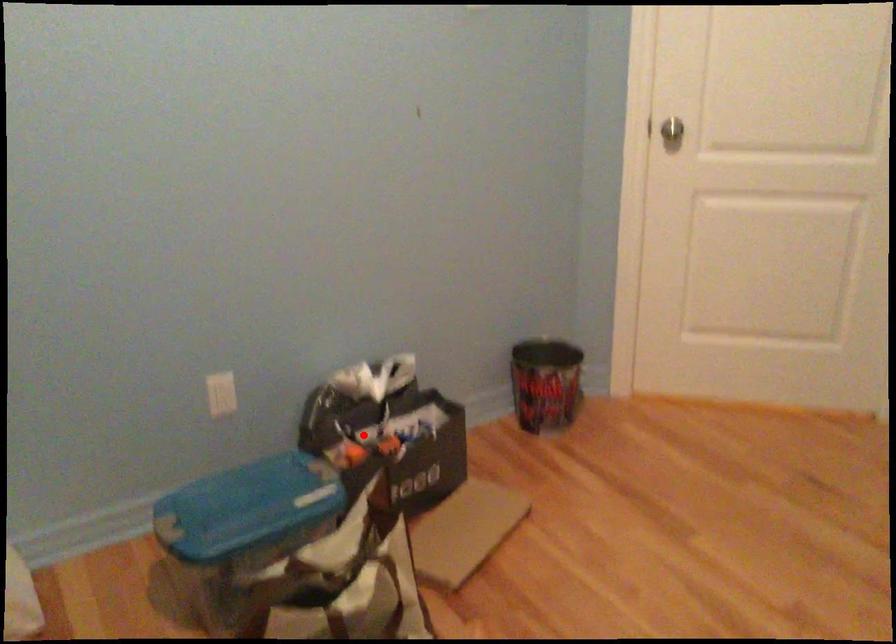
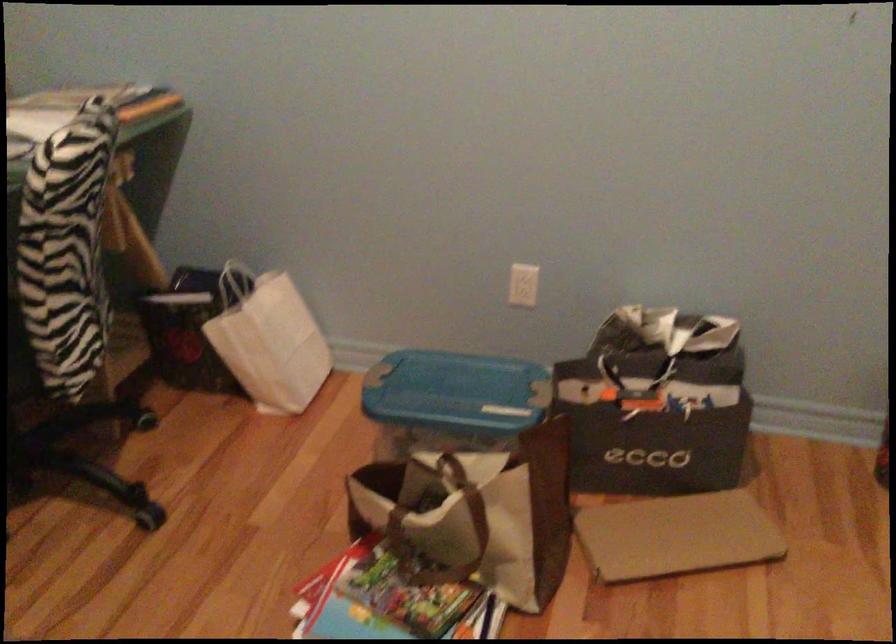
The point at the highlighted location is marked in the first image. Where is the corresponding point in the second image?

(634, 383)